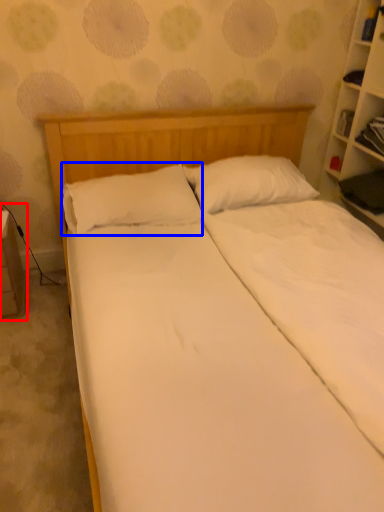
Question: Which of the following is the farthest to the observer, table (highlighted by a red box) or pillow (highlighted by a blue box)?

Choices:
 (A) table
 (B) pillow

Answer: (A)